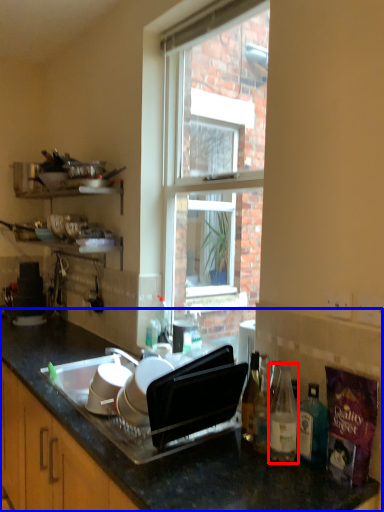
Question: Which point is further to the camera, bottle (highlighted by a red box) or countertop (highlighted by a blue box)?

Choices:
 (A) bottle
 (B) countertop

Answer: (A)